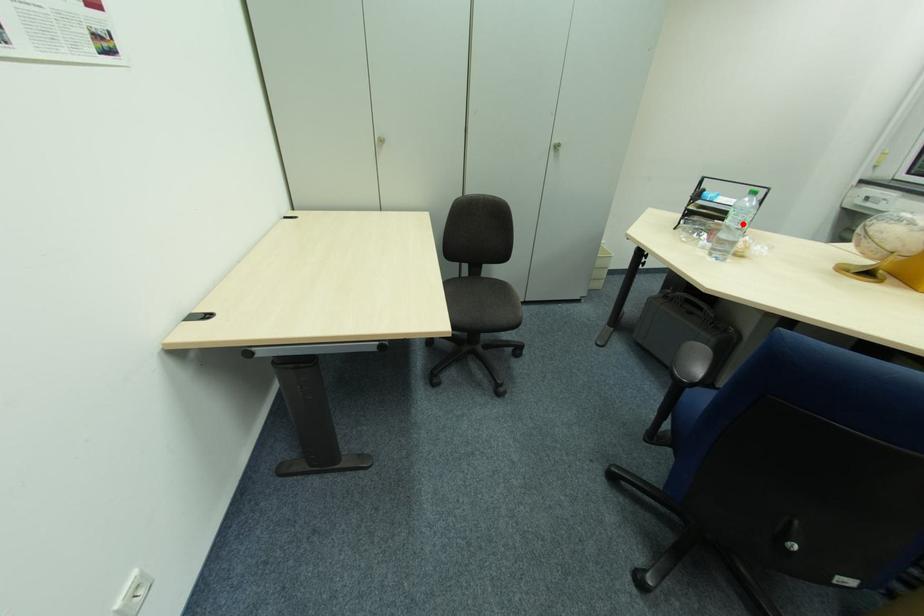
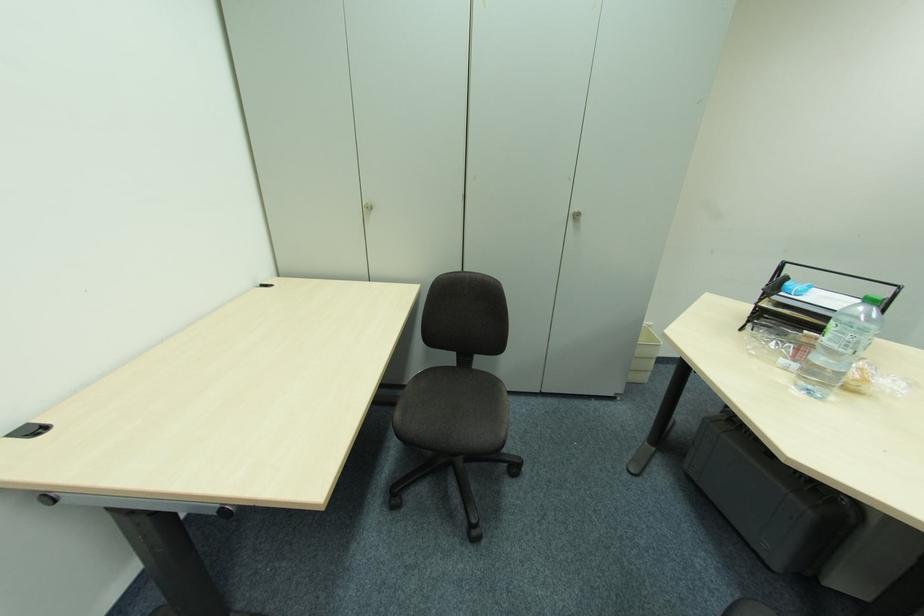
Find the pixel in the second image that matches the highlighted location in the first image.

(850, 347)